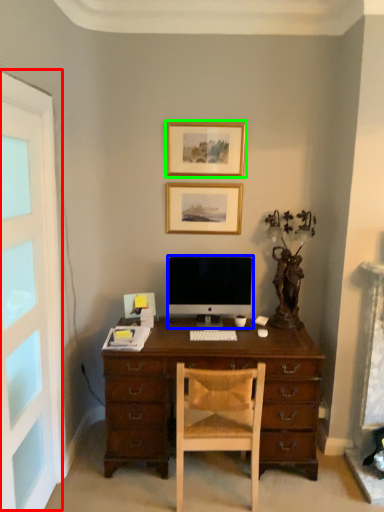
Question: Which object is positioned closest to screen door (highlighted by a red box)? Select from computer monitor (highlighted by a blue box) and picture frame (highlighted by a green box).

Choices:
 (A) computer monitor
 (B) picture frame

Answer: (A)